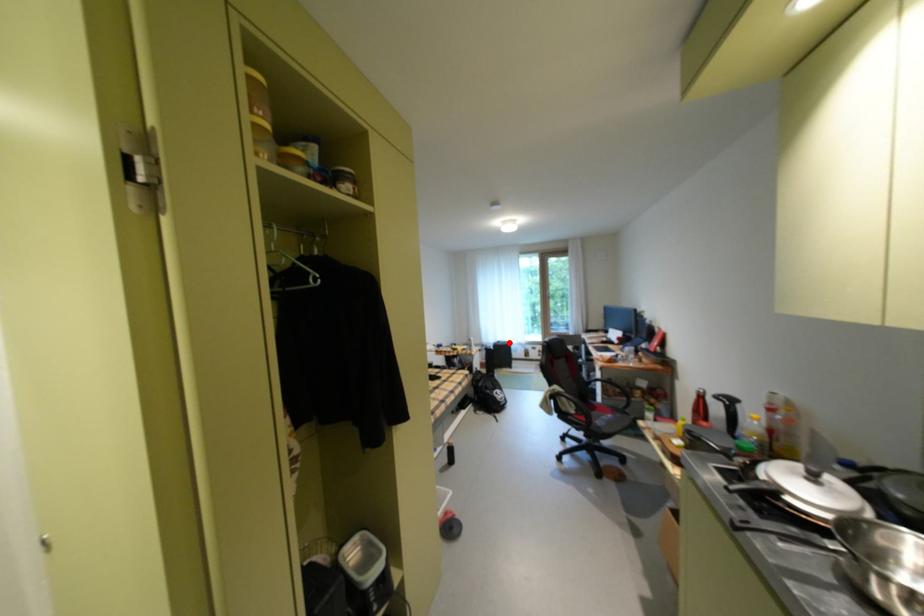
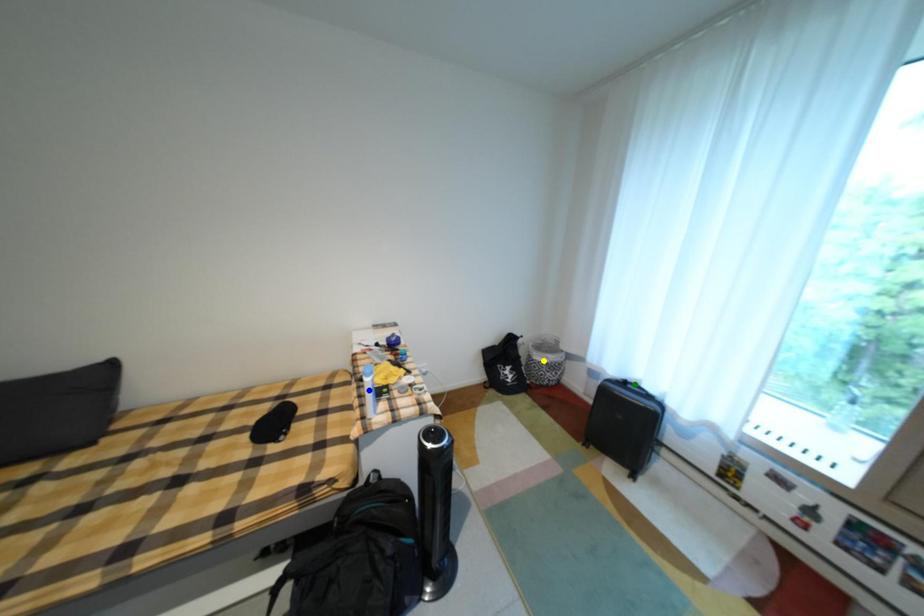
Question: I am providing you with two images of the same scene from different viewpoints. A red point is marked on the first image. You are given multiple points on the second image. Which point in image 2 is actually the same real-world point as the red point in image 1?

Choices:
 (A) blue point
 (B) yellow point
 (C) green point

Answer: (C)